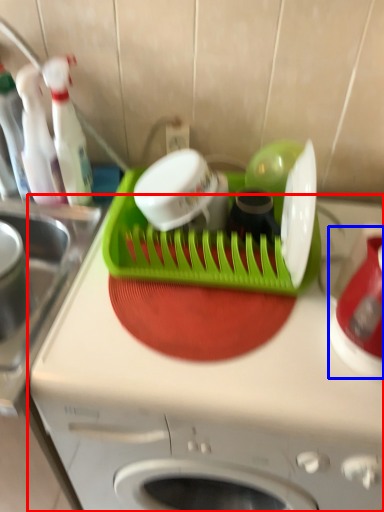
Question: Which point is further to the camera, home appliance (highlighted by a red box) or appliance (highlighted by a blue box)?

Choices:
 (A) home appliance
 (B) appliance

Answer: (A)